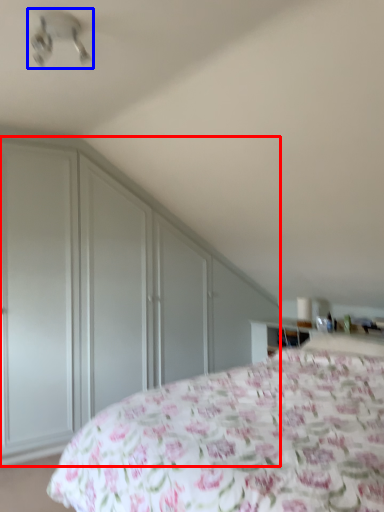
Question: Which of the following is the closest to the observer, dresser (highlighted by a red box) or fan (highlighted by a blue box)?

Choices:
 (A) dresser
 (B) fan

Answer: (B)